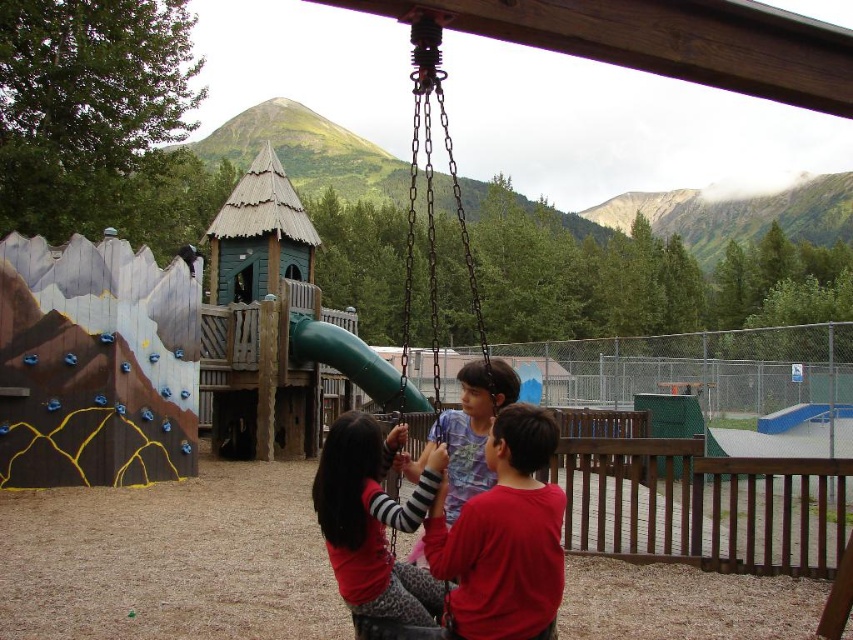
You are a photographer trying to capture a clear photo of both the red cotton shirt at center and the matte red shirt at center. Since you want to focus on the wider one, which shirt should you adjust your camera settings for?

The matte red shirt at center is wider than the red cotton shirt at center, so you should adjust your camera settings to focus on the matte red shirt at center.